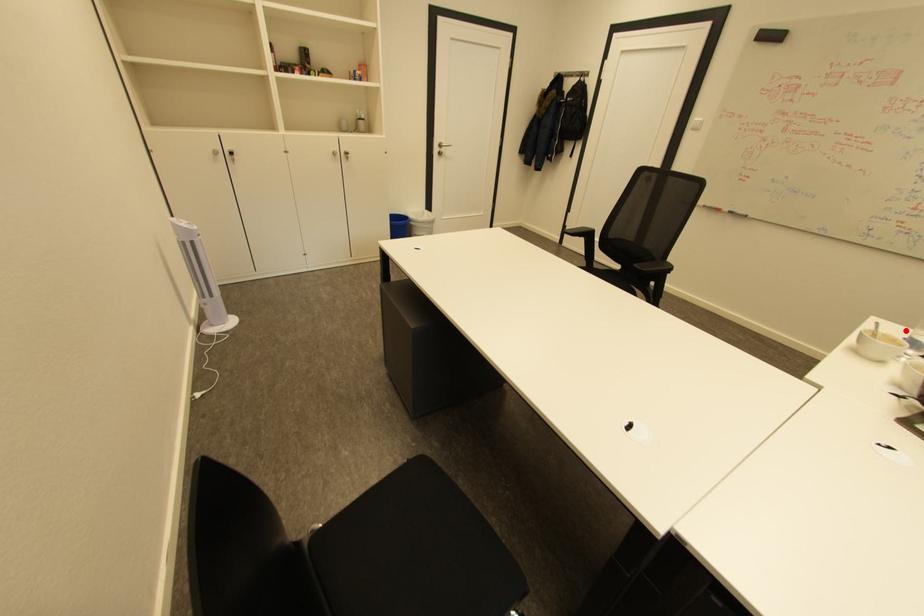
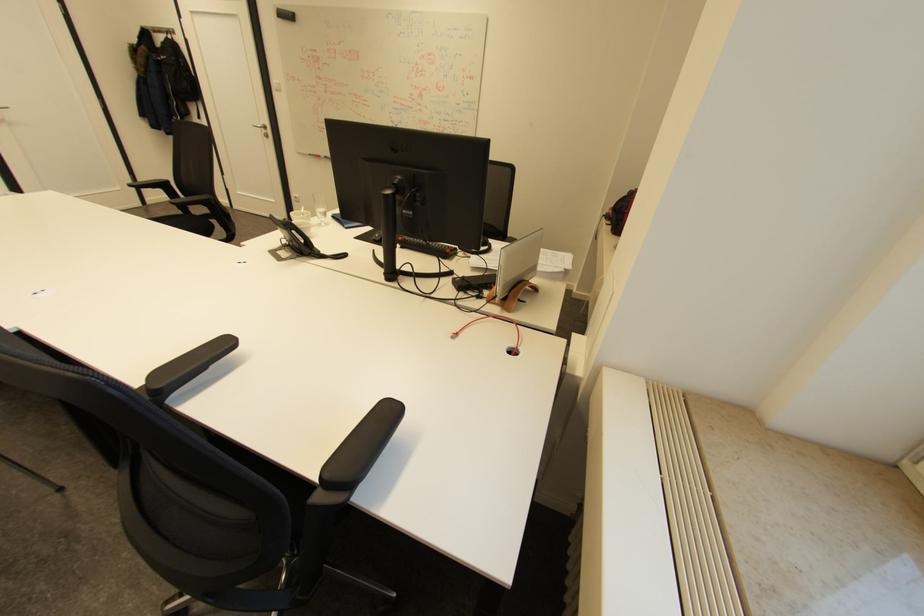
Question: I am providing you with two images of the same scene from different viewpoints. A red point is marked on the first image. Can you still see the location of the red point in image 2?

Choices:
 (A) Yes
 (B) No

Answer: (B)